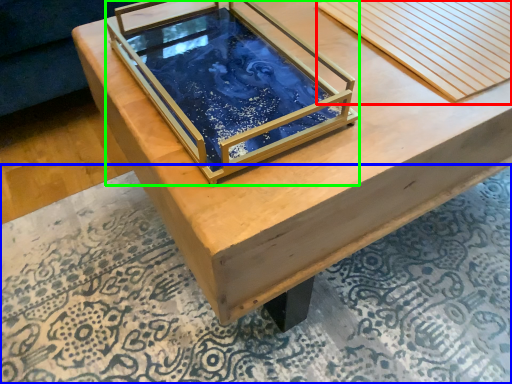
Question: Which object is the farthest from plank (highlighted by a red box)? Choose among these: mat (highlighted by a blue box) or glass box (highlighted by a green box).

Choices:
 (A) mat
 (B) glass box

Answer: (A)